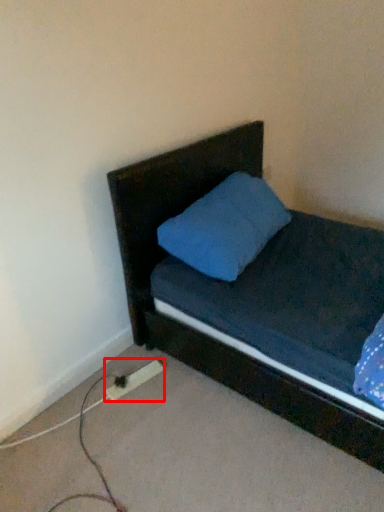
Question: From the image's perspective, where is extension cord (annotated by the red box) located in relation to headboard in the image?

Choices:
 (A) above
 (B) below

Answer: (B)